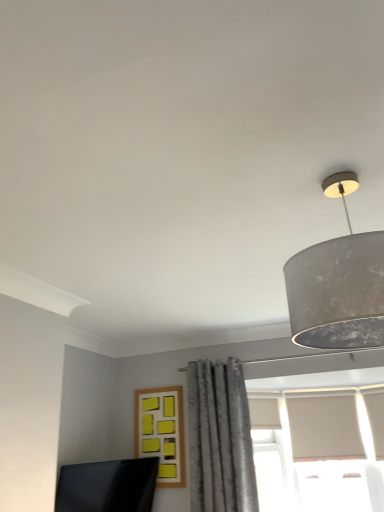
The image size is (384, 512). What are the coordinates of `yellow matte frame at center` in the screenshot? It's located at (161, 432).

What do you see at coordinates (107, 486) in the screenshot? Image resolution: width=384 pixels, height=512 pixels. I see `matte black monitor at lower left` at bounding box center [107, 486].

Locate an element on the screen. matte gray lampshade at upper right is located at coordinates (338, 285).

Image resolution: width=384 pixels, height=512 pixels. Identify the location of yellow matte frame at center. (161, 432).

Considering the points (134, 469) and (376, 300), which point is in front, point (134, 469) or point (376, 300)?

The point (376, 300) is closer to the camera.

Who is shorter, matte black monitor at lower left or matte gray lampshade at upper right?

Standing shorter between the two is matte black monitor at lower left.

Does matte black monitor at lower left have a smaller size compared to matte gray lampshade at upper right?

Yes.

From a real-world perspective, relative to matte gray lampshade at upper right, is matte black monitor at lower left vertically above or below?

matte black monitor at lower left is situated lower than matte gray lampshade at upper right in the real world.

Which is more distant, [325,313] or [166,399]?

Point [166,399]

Does matte gray lampshade at upper right appear on the right side of yellow matte frame at center?

Yes.

Which object is thinner, matte gray lampshade at upper right or yellow matte frame at center?

Thinner between the two is yellow matte frame at center.

Visually, is gray textured curtain at center positioned to the left or to the right of matte gray lampshade at upper right?

Clearly, gray textured curtain at center is on the left of matte gray lampshade at upper right in the image.

Which of these two, gray textured curtain at center or matte gray lampshade at upper right, is wider?

Wider between the two is gray textured curtain at center.

Is gray textured curtain at center shorter than matte gray lampshade at upper right?

In fact, gray textured curtain at center may be taller than matte gray lampshade at upper right.

Is point (172, 472) positioned before point (63, 494)?

No, it is behind (63, 494).

Considering the sizes of objects yellow matte frame at center and matte black monitor at lower left in the image provided, who is smaller, yellow matte frame at center or matte black monitor at lower left?

With smaller size is yellow matte frame at center.

Is yellow matte frame at center not inside matte black monitor at lower left?

Absolutely, yellow matte frame at center is external to matte black monitor at lower left.

Does yellow matte frame at center appear on the right side of matte black monitor at lower left?

Yes.

Which is in front, yellow matte frame at center or matte gray lampshade at upper right?

matte gray lampshade at upper right is more forward.

Consider the image. From the image's perspective, is yellow matte frame at center on top of matte gray lampshade at upper right?

Incorrect, from the image's perspective, yellow matte frame at center is lower than matte gray lampshade at upper right.

Can you confirm if yellow matte frame at center is shorter than matte gray lampshade at upper right?

No, yellow matte frame at center is not shorter than matte gray lampshade at upper right.

Would you say yellow matte frame at center is a long distance from matte gray lampshade at upper right?

yellow matte frame at center is far away from matte gray lampshade at upper right.

Considering the sizes of objects matte black monitor at lower left and yellow matte frame at center in the image provided, who is taller, matte black monitor at lower left or yellow matte frame at center?

With more height is yellow matte frame at center.

Does point (154, 458) come closer to viewer compared to point (145, 431)?

That is True.

Based on the photo, from a real-world perspective, is matte black monitor at lower left physically below yellow matte frame at center?

Correct, in the physical world, matte black monitor at lower left is lower than yellow matte frame at center.

Is matte black monitor at lower left oriented towards yellow matte frame at center?

No, matte black monitor at lower left does not turn towards yellow matte frame at center.

Is the surface of gray textured curtain at center in direct contact with matte black monitor at lower left?

No.

From a real-world perspective, which is physically below, gray textured curtain at center or matte black monitor at lower left?

From a 3D spatial view, matte black monitor at lower left is below.

How different are the orientations of gray textured curtain at center and matte black monitor at lower left in degrees?

There is a 71.9-degree angle between the facing directions of gray textured curtain at center and matte black monitor at lower left.

This screenshot has height=512, width=384. What are the coordinates of `lamp above the matte black monitor at lower left (from the image's perspective)` in the screenshot? It's located at (338, 285).

You are a GUI agent. You are given a task and a screenshot of the screen. Output one action in this format:
    pyautogui.click(x=<x>, y=<y>)
    Task: Click on the window that is under the matte gray lampshade at upper right (from a real-world perspective)
    
    Given the screenshot: What is the action you would take?
    tap(161, 432)

Looking at the image, which one is located further to yellow matte frame at center, matte gray lampshade at upper right or gray textured curtain at center?

matte gray lampshade at upper right.

Looking at this image, considering their positions, is matte black monitor at lower left positioned closer to yellow matte frame at center than matte gray lampshade at upper right?

Based on the image, matte black monitor at lower left appears to be nearer to yellow matte frame at center.

Which object lies further to the anchor point matte black monitor at lower left, gray textured curtain at center or yellow matte frame at center?

gray textured curtain at center is positioned further to the anchor matte black monitor at lower left.

Considering their positions, is matte gray lampshade at upper right positioned further to gray textured curtain at center than matte black monitor at lower left?

The object further to gray textured curtain at center is matte gray lampshade at upper right.

Which object lies further to the anchor point yellow matte frame at center, matte black monitor at lower left or gray textured curtain at center?

matte black monitor at lower left.

From the image, which object appears to be nearer to gray textured curtain at center, matte gray lampshade at upper right or yellow matte frame at center?

Among the two, yellow matte frame at center is located nearer to gray textured curtain at center.

Based on their spatial positions, is yellow matte frame at center or matte black monitor at lower left closer to matte gray lampshade at upper right?

matte black monitor at lower left.

From the image, which object appears to be farther from gray textured curtain at center, yellow matte frame at center or matte black monitor at lower left?

matte black monitor at lower left.

The height and width of the screenshot is (512, 384). I want to click on curtain positioned between matte gray lampshade at upper right and yellow matte frame at center from near to far, so click(x=220, y=439).

Where is `computer monitor positioned between matte gray lampshade at upper right and yellow matte frame at center from near to far`? The image size is (384, 512). computer monitor positioned between matte gray lampshade at upper right and yellow matte frame at center from near to far is located at coordinates (107, 486).

The image size is (384, 512). Find the location of `computer monitor between matte gray lampshade at upper right and gray textured curtain at center in the front-back direction`. computer monitor between matte gray lampshade at upper right and gray textured curtain at center in the front-back direction is located at coordinates (107, 486).

You are a GUI agent. You are given a task and a screenshot of the screen. Output one action in this format:
    pyautogui.click(x=<x>, y=<y>)
    Task: Click on the window situated between matte black monitor at lower left and gray textured curtain at center from left to right
    Image resolution: width=384 pixels, height=512 pixels.
    Given the screenshot: What is the action you would take?
    pyautogui.click(x=161, y=432)